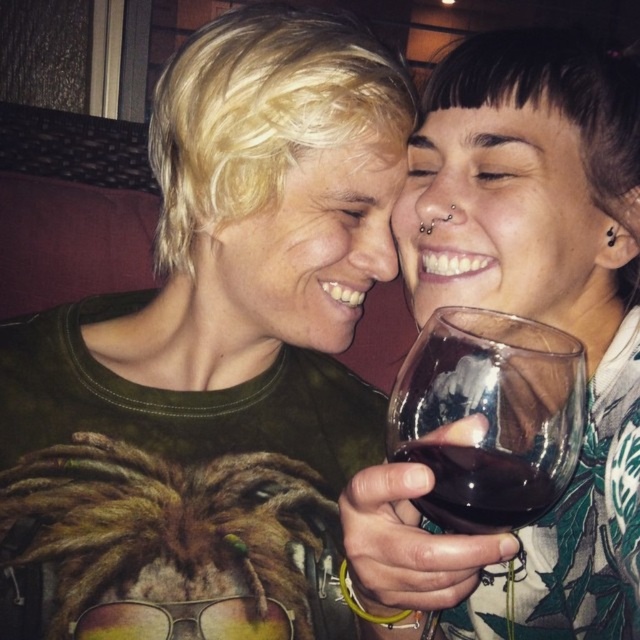
Between translucent glass wine at upper right and transparent glass at center, which one has less height?

transparent glass at center is shorter.

Who is positioned more to the right, translucent glass wine at upper right or transparent glass at center?

translucent glass wine at upper right

This screenshot has width=640, height=640. I want to click on translucent glass wine at upper right, so click(545, 278).

Is transparent glass at center thinner than dark glass at center?

No.

Can you confirm if transparent glass at center is shorter than dark glass at center?

No.

Between point (461, 504) and point (432, 460), which one is positioned behind?

Positioned behind is point (432, 460).

What are the coordinates of `transparent glass at center` in the screenshot? It's located at (490, 417).

Who is lower down, translucent glass wine at upper right or dark glass at center?

dark glass at center is lower down.

Between point (579, 468) and point (493, 484), which one is positioned in front?

Positioned in front is point (493, 484).

Where is `translucent glass wine at upper right`? translucent glass wine at upper right is located at coordinates (545, 278).